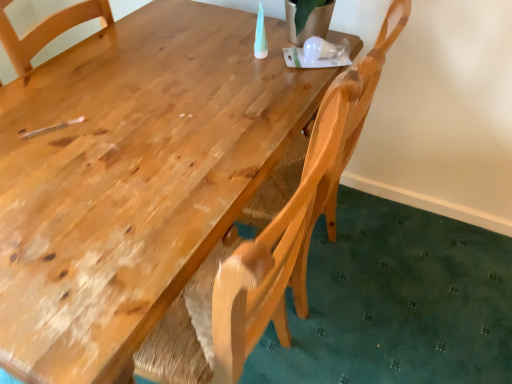
Image resolution: width=512 pixels, height=384 pixels. What do you see at coordinates (272, 236) in the screenshot?
I see `wooden chair at center` at bounding box center [272, 236].

In order to face wooden chair at center, should I rotate leftwards or rightwards?

To face it directly, rotate right by 5.955 degrees.

Locate an element on the screen. This screenshot has width=512, height=384. wooden chair at center is located at coordinates (272, 236).

Locate an element on the screen. The width and height of the screenshot is (512, 384). wooden chair at center is located at coordinates (272, 236).